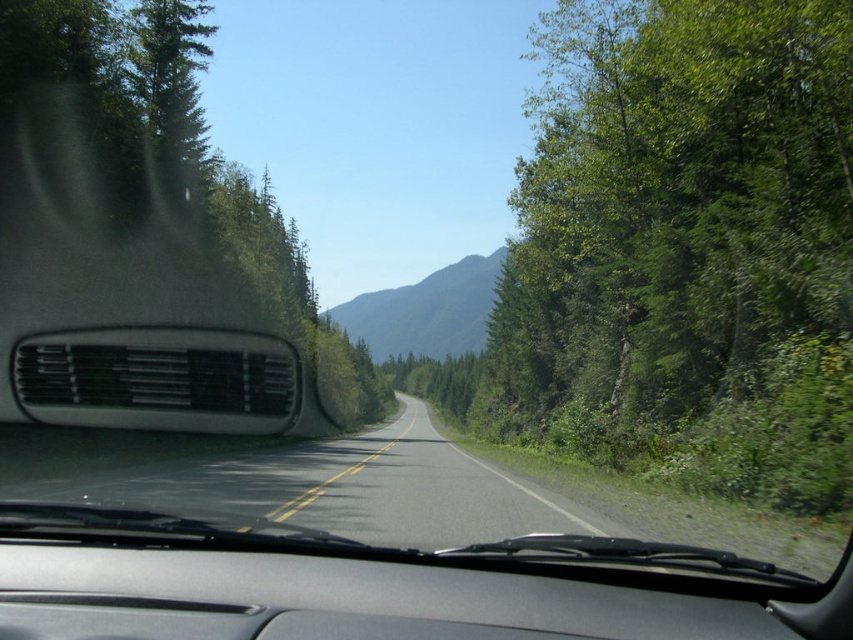
You are driving and need to stay on the right side of the road. Which object, the green leafy tree at right or the green forested mountain at center, is closer to your right side?

The green leafy tree at right is closer to your right side because it is positioned to the right of the green forested mountain at center.

You are a passenger in the car and looking out the window. The green leafy tree at right is in your view. Where on the window is it located?

The green leafy tree at right is located at the 2D coordinates point (674, 204) on the window.

You are driving a car and looking through the windshield. You see a green matte tree at left and a black asphalt road at center. Which object is bigger in your view?

The green matte tree at left is larger in size compared to the black asphalt road at center, so the green matte tree at left appears bigger in your view.